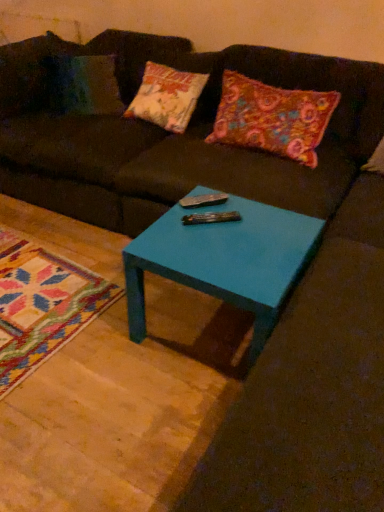
The width and height of the screenshot is (384, 512). I want to click on matte brown couch at center, so click(x=173, y=135).

Locate an element on the screen. The image size is (384, 512). matte brown couch at center is located at coordinates (173, 135).

Which of these two, metallic silver remote at center or matte brown couch at center, stands taller?

Standing taller between the two is matte brown couch at center.

Which is behind, metallic silver remote at center or matte brown couch at center?

metallic silver remote at center is more distant.

Does metallic silver remote at center turn towards matte brown couch at center?

No, metallic silver remote at center does not turn towards matte brown couch at center.

Is metallic silver remote at center in contact with matte brown couch at center?

metallic silver remote at center and matte brown couch at center are clearly separated.

Is teal glossy table at center turned away from metallic silver remote at center?

No, teal glossy table at center is not facing the opposite direction of metallic silver remote at center.

Relative to metallic silver remote at center, is teal glossy table at center in front or behind?

In the image, teal glossy table at center appears in front of metallic silver remote at center.

Is teal glossy table at center to the right of metallic silver remote at center from the viewer's perspective?

Indeed, teal glossy table at center is positioned on the right side of metallic silver remote at center.

From the image's perspective, which object appears higher, teal glossy table at center or metallic silver remote at center?

metallic silver remote at center is shown above in the image.

Which is more distant, (246, 215) or (284, 122)?

Positioned behind is point (284, 122).

Which object is thinner, teal glossy table at center or multicolored felt pillow at upper right?

With smaller width is multicolored felt pillow at upper right.

Is teal glossy table at center taller than multicolored felt pillow at upper right?

In fact, teal glossy table at center may be shorter than multicolored felt pillow at upper right.

Looking at this image, is teal glossy table at center oriented towards multicolored felt pillow at upper right?

No, teal glossy table at center is not oriented towards multicolored felt pillow at upper right.

Is matte brown couch at center with metallic silver remote at center?

No, matte brown couch at center is not with metallic silver remote at center.

What's the angular difference between matte brown couch at center and metallic silver remote at center's facing directions?

The angle between the facing direction of matte brown couch at center and the facing direction of metallic silver remote at center is 49.5 degrees.

Is matte brown couch at center positioned beyond the bounds of metallic silver remote at center?

Yes, matte brown couch at center is not within metallic silver remote at center.

Between matte brown couch at center and metallic silver remote at center, which one is positioned behind?

metallic silver remote at center is further from the camera.

Does metallic silver remote at center appear on the right side of multicolored felt pillow at upper right?

No, metallic silver remote at center is not to the right of multicolored felt pillow at upper right.

Can you confirm if metallic silver remote at center is smaller than multicolored felt pillow at upper right?

Yes.

Would you say metallic silver remote at center contains multicolored felt pillow at upper right?

No, multicolored felt pillow at upper right is not inside metallic silver remote at center.

Considering the relative positions of metallic silver remote at center and multicolored felt pillow at upper right in the image provided, is metallic silver remote at center in front of multicolored felt pillow at upper right?

Yes.

Looking at this image, between metallic silver remote at center and teal glossy table at center, which one has less height?

Standing shorter between the two is metallic silver remote at center.

Considering the positions of objects metallic silver remote at center and teal glossy table at center in the image provided, who is in front, metallic silver remote at center or teal glossy table at center?

teal glossy table at center.

Is metallic silver remote at center situated inside teal glossy table at center or outside?

metallic silver remote at center exists entirely within teal glossy table at center.

Is point (208, 220) closer or farther from the camera than point (274, 270)?

Clearly, point (208, 220) is more distant from the camera than point (274, 270).

Would you say multicolored felt pillow at upper right is a long distance from teal glossy table at center?

That's not correct — multicolored felt pillow at upper right is a little close to teal glossy table at center.

Between multicolored felt pillow at upper right and teal glossy table at center, which one appears on the left side from the viewer's perspective?

teal glossy table at center is more to the left.

Between multicolored felt pillow at upper right and teal glossy table at center, which one has larger size?

With larger size is teal glossy table at center.

The height and width of the screenshot is (512, 384). I want to click on studio couch on the left of metallic silver remote at center, so click(x=173, y=135).

This screenshot has height=512, width=384. Identify the location of coffee table below the metallic silver remote at center (from the image's perspective). [224, 260].

Considering their positions, is teal glossy table at center positioned closer to matte brown couch at center than metallic silver remote at center?

teal glossy table at center.

When comparing their distances from metallic silver remote at center, does matte brown couch at center or teal glossy table at center seem closer?

teal glossy table at center is closer to metallic silver remote at center.

Looking at the image, which one is located further to teal glossy table at center, matte brown couch at center or metallic silver remote at center?

matte brown couch at center.

Looking at the image, which one is located further to metallic silver remote at center, teal glossy table at center or matte brown couch at center?

The object further to metallic silver remote at center is matte brown couch at center.

From the image, which object appears to be nearer to metallic silver remote at center, multicolored felt pillow at upper right or teal glossy table at center?

Based on the image, teal glossy table at center appears to be nearer to metallic silver remote at center.

Looking at the image, which one is located closer to teal glossy table at center, multicolored felt pillow at upper right or metallic silver remote at center?

metallic silver remote at center lies closer to teal glossy table at center than the other object.

Based on their spatial positions, is multicolored felt pillow at upper right or matte brown couch at center further from metallic silver remote at center?

matte brown couch at center is further to metallic silver remote at center.

Estimate the real-world distances between objects in this image. Which object is further from multicolored felt pillow at upper right, teal glossy table at center or matte brown couch at center?

teal glossy table at center lies further to multicolored felt pillow at upper right than the other object.

You are a GUI agent. You are given a task and a screenshot of the screen. Output one action in this format:
    pyautogui.click(x=<x>, y=<y>)
    Task: Click on the studio couch between multicolored felt pillow at upper right and metallic silver remote at center in the up-down direction
    
    Given the screenshot: What is the action you would take?
    pyautogui.click(x=173, y=135)

At what (x,y) coordinates should I click in order to perform the action: click on studio couch between multicolored felt pillow at upper right and teal glossy table at center in the up-down direction. Please return your answer as a coordinate pair (x, y). Looking at the image, I should click on (173, 135).

The width and height of the screenshot is (384, 512). I want to click on remote between matte brown couch at center and teal glossy table at center vertically, so click(211, 218).

Find the location of `remote between multicolored felt pillow at upper right and teal glossy table at center vertically`. remote between multicolored felt pillow at upper right and teal glossy table at center vertically is located at coordinates (211, 218).